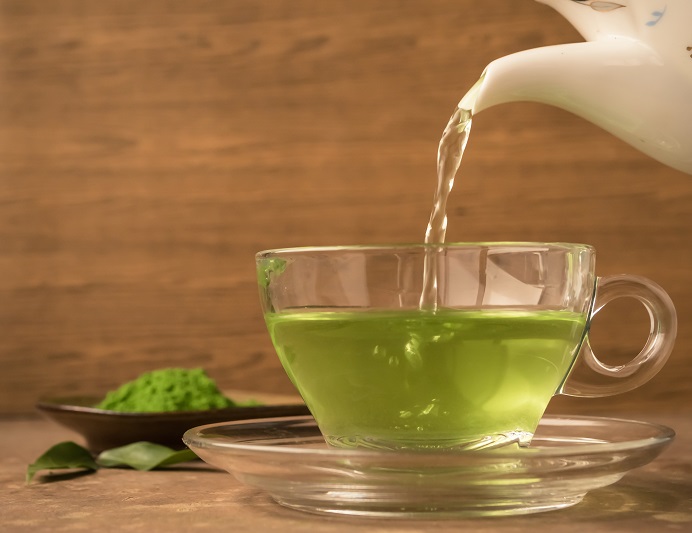
Where is `small brown bowl`? This screenshot has height=533, width=692. small brown bowl is located at coordinates (127, 433).